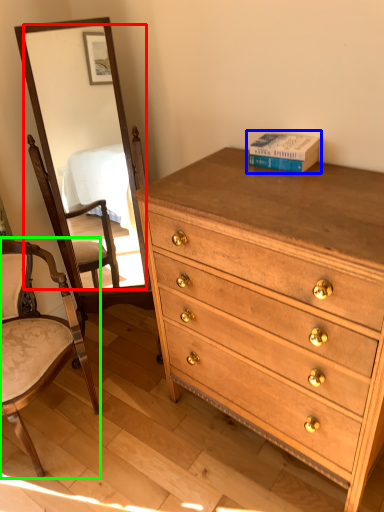
Question: Which object is positioned farthest from mirror (highlighted by a red box)? Select from book (highlighted by a blue box) and chair (highlighted by a green box).

Choices:
 (A) book
 (B) chair

Answer: (A)